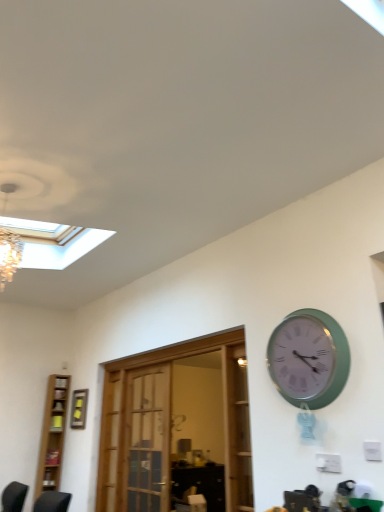
Question: Considering the relative sizes of yellow matte picture frame at upper left and light brown wooden bookshelf at left in the image provided, is yellow matte picture frame at upper left wider than light brown wooden bookshelf at left?

Choices:
 (A) yes
 (B) no

Answer: (B)

Question: Is yellow matte picture frame at upper left shorter than light brown wooden bookshelf at left?

Choices:
 (A) yes
 (B) no

Answer: (A)

Question: Is yellow matte picture frame at upper left next to light brown wooden bookshelf at left?

Choices:
 (A) yes
 (B) no

Answer: (B)

Question: Is yellow matte picture frame at upper left to the right of light brown wooden bookshelf at left from the viewer's perspective?

Choices:
 (A) no
 (B) yes

Answer: (B)

Question: Is yellow matte picture frame at upper left completely or partially outside of light brown wooden bookshelf at left?

Choices:
 (A) yes
 (B) no

Answer: (A)

Question: In terms of height, does light brown wooden bookshelf at left look taller or shorter compared to wooden door at center?

Choices:
 (A) short
 (B) tall

Answer: (B)

Question: From a real-world perspective, is light brown wooden bookshelf at left physically located above or below wooden door at center?

Choices:
 (A) above
 (B) below

Answer: (A)

Question: From the image's perspective, is light brown wooden bookshelf at left located above or below wooden door at center?

Choices:
 (A) above
 (B) below

Answer: (B)

Question: Choose the correct answer: Is light brown wooden bookshelf at left inside wooden door at center or outside it?

Choices:
 (A) inside
 (B) outside

Answer: (B)

Question: Is wooden door at center to the left or to the right of green plastic wall clock at upper right in the image?

Choices:
 (A) left
 (B) right

Answer: (A)

Question: Is wooden door at center taller or shorter than green plastic wall clock at upper right?

Choices:
 (A) short
 (B) tall

Answer: (B)

Question: In the image, is wooden door at center positioned in front of or behind green plastic wall clock at upper right?

Choices:
 (A) behind
 (B) front

Answer: (A)

Question: Looking at the image, does wooden door at center seem bigger or smaller compared to green plastic wall clock at upper right?

Choices:
 (A) big
 (B) small

Answer: (A)

Question: Is yellow matte picture frame at upper left inside the boundaries of wooden door at center, or outside?

Choices:
 (A) inside
 (B) outside

Answer: (B)

Question: Considering their positions, is yellow matte picture frame at upper left located in front of or behind wooden door at center?

Choices:
 (A) front
 (B) behind

Answer: (B)